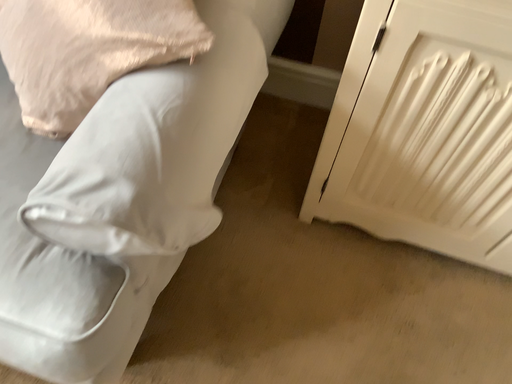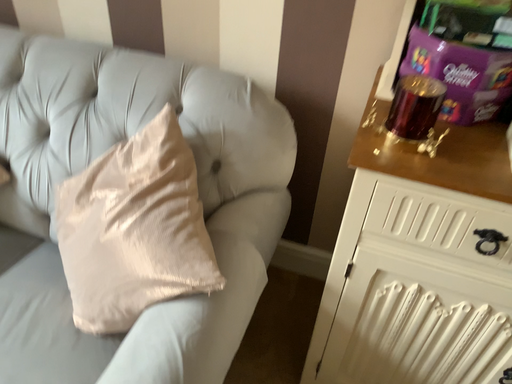
Question: Which way did the camera rotate in the video?

Choices:
 (A) rotated upward
 (B) rotated downward

Answer: (A)